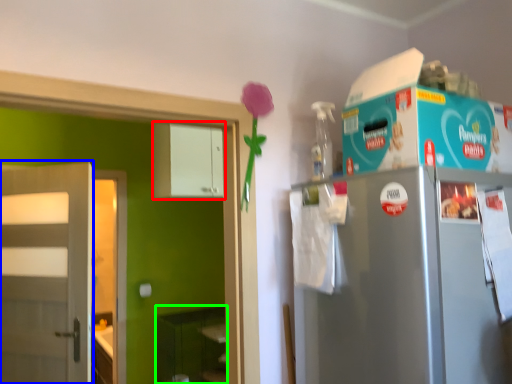
Question: Estimate the real-world distances between objects in this image. Which object is closer to cabinetry (highlighted by a red box), door (highlighted by a blue box) or shelf (highlighted by a green box)?

Choices:
 (A) door
 (B) shelf

Answer: (A)